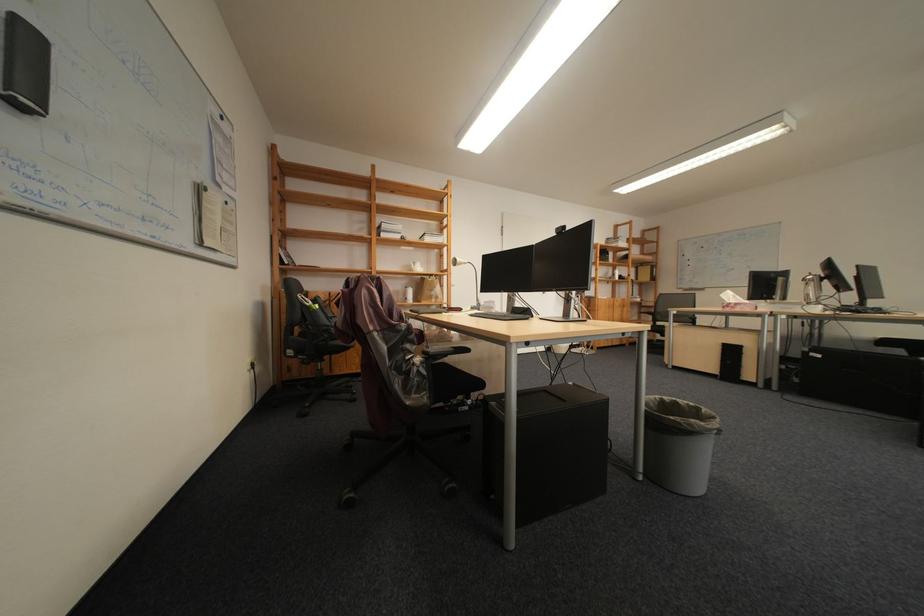
The width and height of the screenshot is (924, 616). What do you see at coordinates (442, 353) in the screenshot?
I see `a black chair armrest` at bounding box center [442, 353].